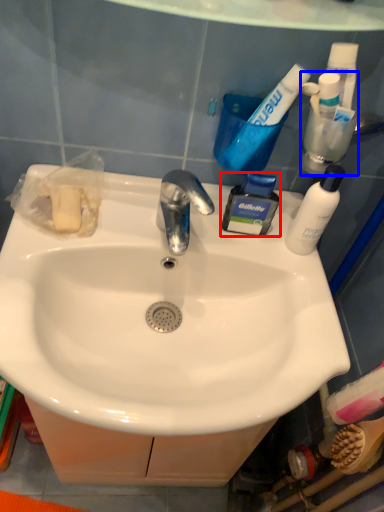
Question: Which object appears closest to the camera in this image, toiletry (highlighted by a red box) or toiletry (highlighted by a blue box)?

Choices:
 (A) toiletry
 (B) toiletry

Answer: (B)